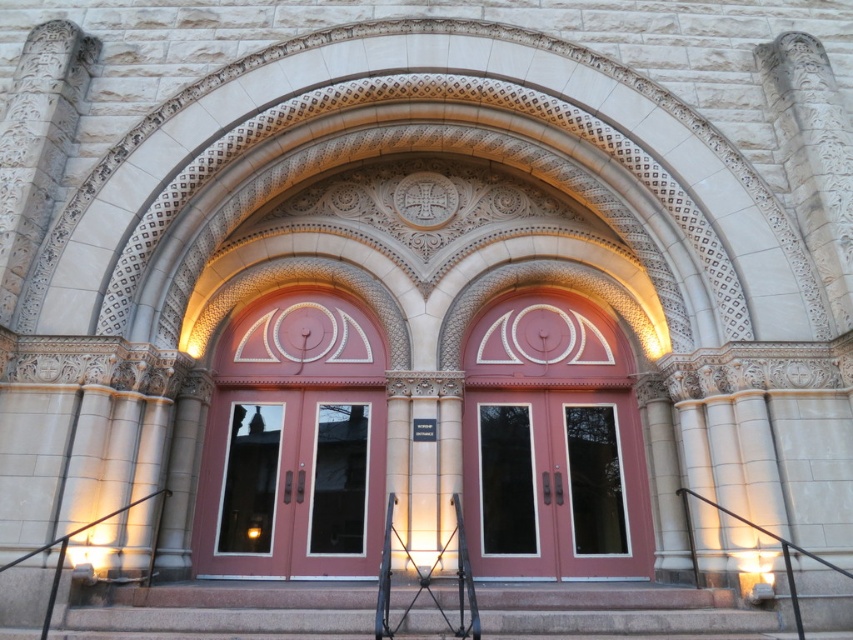
You are a delivery person with a cart that requires a 10 meter path to maneuver. You need to move from the granite steps at center to the matte glass doors at center. Is there enough space for your cart to move directly between them?

The matte glass doors at center is 10.16 meters from granite steps at center, so yes, there is enough space for the cart to maneuver since the distance is slightly over 10 meters.

You are an architect designing a new building entrance. You have two options for the doors at the center of the entrance. The first option is matte glass doors at center, and the second option is matte wood doors at center. Based on their heights, which door type would allow for a taller entrance design?

The matte wood doors at center are taller than the matte glass doors at center, so choosing matte wood doors at center would allow for a taller entrance design.

You are a painter who needs to decide whether to bring a ladder or a step stool to paint the matte wood doors at center and the granite steps at center. Based on their heights, which tool would be more appropriate for each object?

The matte wood doors at center has a greater height compared to granite steps at center, so a ladder would be more appropriate for the matte wood doors at center and a step stool for the granite steps at center.